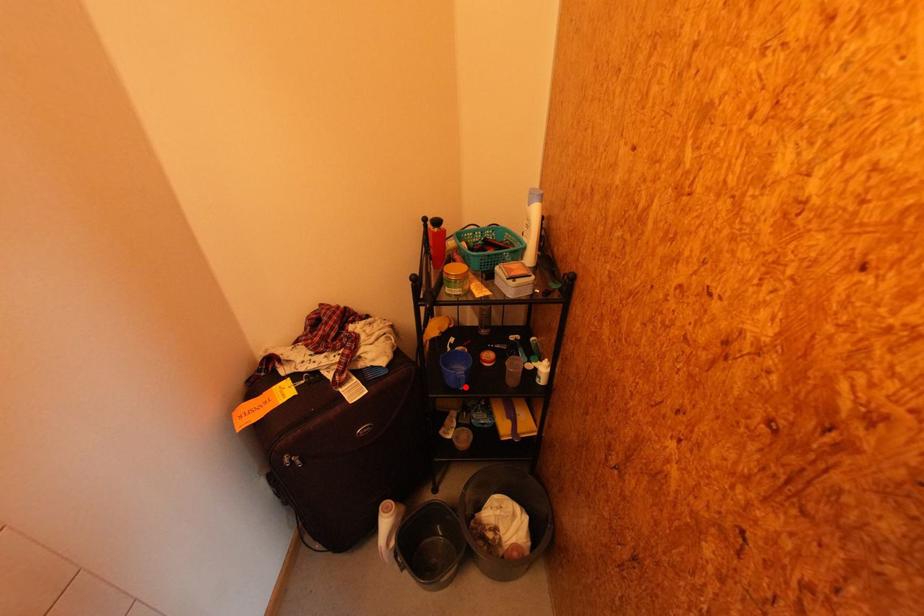
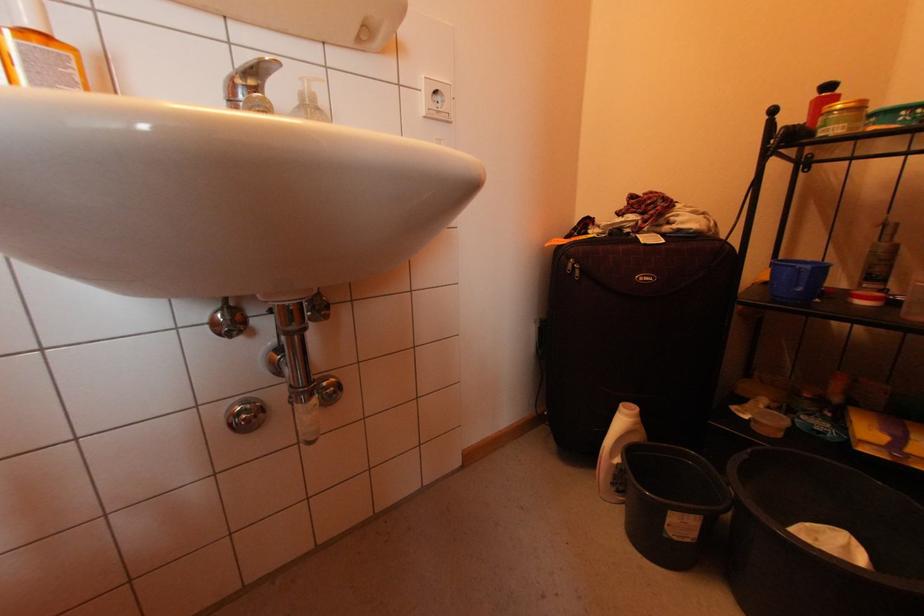
Question: I am providing you with two images of the same scene from different viewpoints. A red point is shown in image1. For the corresponding object point in image2, is it positioned nearer or farther from the camera?

Choices:
 (A) Nearer
 (B) Farther

Answer: (A)